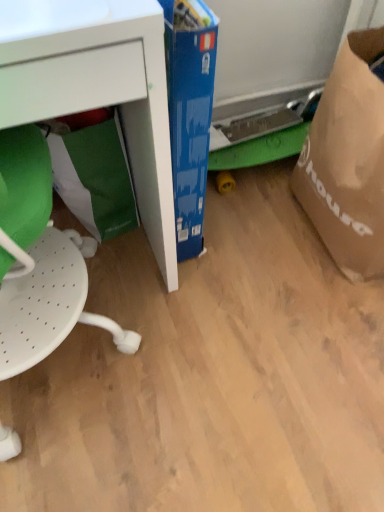
What do you see at coordinates (348, 159) in the screenshot? I see `brown paper grocery bag at right, which is the 2th grocery bag in left-to-right order` at bounding box center [348, 159].

Identify the location of white matte desk at lower left. The image size is (384, 512). (97, 88).

Identify the location of blue cardboard box at center. The height and width of the screenshot is (512, 384). (190, 113).

Measure the distance between point [27,174] and camera.

Point [27,174] is 28.23 inches away from camera.

You are a GUI agent. You are given a task and a screenshot of the screen. Output one action in this format:
    pyautogui.click(x=<x>, y=<y>)
    Task: Click on the brown paper grocery bag at right, which is counted as the first grocery bag, starting from the right
    This screenshot has width=384, height=512.
    Given the screenshot: What is the action you would take?
    pyautogui.click(x=348, y=159)

Between white perforated swivel chair at left and blue cardboard box at center, which one is positioned in front?

Positioned in front is white perforated swivel chair at left.

Can you confirm if white perforated swivel chair at left is shorter than blue cardboard box at center?

In fact, white perforated swivel chair at left may be taller than blue cardboard box at center.

From a real-world perspective, does white perforated swivel chair at left sit lower than blue cardboard box at center?

No, from a real-world perspective, white perforated swivel chair at left is not beneath blue cardboard box at center.

Which is behind, point (24, 360) or point (352, 68)?

The point (352, 68) is farther from the camera.

Can you confirm if white perforated swivel chair at left is positioned to the right of brown paper grocery bag at right, which is the 2th grocery bag in left-to-right order?

No, white perforated swivel chair at left is not to the right of brown paper grocery bag at right, which is the 2th grocery bag in left-to-right order.

Is white perforated swivel chair at left taller than brown paper grocery bag at right, which is the 2th grocery bag in left-to-right order?

Indeed, white perforated swivel chair at left has a greater height compared to brown paper grocery bag at right, which is the 2th grocery bag in left-to-right order.

Is green paper bag at lower left, the second grocery bag from the right, aimed at white matte desk at lower left?

Yes, green paper bag at lower left, the second grocery bag from the right, is aimed at white matte desk at lower left.

Who is taller, green paper bag at lower left, the second grocery bag from the right, or white matte desk at lower left?

white matte desk at lower left is taller.

The image size is (384, 512). Find the location of `grocery bag below the white matte desk at lower left (from the image's perspective)`. grocery bag below the white matte desk at lower left (from the image's perspective) is located at coordinates (93, 175).

Which of these two, green paper bag at lower left, which ranks as the 1th grocery bag in left-to-right order, or white matte desk at lower left, is bigger?

white matte desk at lower left.

Is blue cardboard box at center taller than white perforated swivel chair at left?

No, blue cardboard box at center is not taller than white perforated swivel chair at left.

Which is more to the left, blue cardboard box at center or white perforated swivel chair at left?

From the viewer's perspective, white perforated swivel chair at left appears more on the left side.

Considering the sizes of objects blue cardboard box at center and white perforated swivel chair at left in the image provided, who is thinner, blue cardboard box at center or white perforated swivel chair at left?

blue cardboard box at center.

Is point (179, 237) closer to viewer compared to point (119, 345)?

No, it is behind (119, 345).

Is brown paper grocery bag at right, which is counted as the first grocery bag, starting from the right, taller or shorter than green paper bag at lower left, the second grocery bag from the right?

Clearly, brown paper grocery bag at right, which is counted as the first grocery bag, starting from the right, is taller compared to green paper bag at lower left, the second grocery bag from the right.

Is point (377, 226) closer or farther from the camera than point (104, 193)?

Clearly, point (377, 226) is closer to the camera than point (104, 193).

Are brown paper grocery bag at right, which is the 2th grocery bag in left-to-right order, and green paper bag at lower left, which ranks as the 1th grocery bag in left-to-right order, making contact?

No, brown paper grocery bag at right, which is the 2th grocery bag in left-to-right order, is not next to green paper bag at lower left, which ranks as the 1th grocery bag in left-to-right order.

In terms of width, does brown paper grocery bag at right, which is counted as the first grocery bag, starting from the right, look wider or thinner when compared to green paper bag at lower left, the second grocery bag from the right?

In the image, brown paper grocery bag at right, which is counted as the first grocery bag, starting from the right, appears to be wider than green paper bag at lower left, the second grocery bag from the right.

Where is `desk lying on the left of blue cardboard box at center`? This screenshot has height=512, width=384. desk lying on the left of blue cardboard box at center is located at coordinates (97, 88).

Is blue cardboard box at center at the right side of white matte desk at lower left?

Yes, blue cardboard box at center is to the right of white matte desk at lower left.

Does point (166, 2) lie in front of point (141, 39)?

That is False.

From the picture: Is blue cardboard box at center located outside white matte desk at lower left?

Yes, blue cardboard box at center is not within white matte desk at lower left.

Is point (330, 207) positioned behind point (82, 84)?

Yes, point (330, 207) is behind point (82, 84).

From the image's perspective, which one is positioned lower, brown paper grocery bag at right, which is counted as the first grocery bag, starting from the right, or white matte desk at lower left?

From the image's view, white matte desk at lower left is below.

How different are the orientations of brown paper grocery bag at right, which is the 2th grocery bag in left-to-right order, and white matte desk at lower left in degrees?

The facing directions of brown paper grocery bag at right, which is the 2th grocery bag in left-to-right order, and white matte desk at lower left are 91.6 degrees apart.

From the white matte desk at lower left, count 2nd grocery bag to the right and point to it. Please provide its 2D coordinates.

[(348, 159)]

At what (x,y) coordinates should I click in order to perform the action: click on swivel chair in front of the blue cardboard box at center. Please return your answer as a coordinate pair (x, y). Looking at the image, I should click on (39, 261).

Where is `swivel chair lying on the left of brown paper grocery bag at right, which is the 2th grocery bag in left-to-right order`? This screenshot has height=512, width=384. swivel chair lying on the left of brown paper grocery bag at right, which is the 2th grocery bag in left-to-right order is located at coordinates (39, 261).

In the scene shown: Which object lies nearer to the anchor point blue cardboard box at center, white matte desk at lower left or brown paper grocery bag at right, which is counted as the first grocery bag, starting from the right?

white matte desk at lower left lies closer to blue cardboard box at center than the other object.

Estimate the real-world distances between objects in this image. Which object is closer to brown paper grocery bag at right, which is counted as the first grocery bag, starting from the right, white matte desk at lower left or blue cardboard box at center?

Among the two, blue cardboard box at center is located nearer to brown paper grocery bag at right, which is counted as the first grocery bag, starting from the right.

In the scene shown: Based on their spatial positions, is white perforated swivel chair at left or white matte desk at lower left closer to green paper bag at lower left, which ranks as the 1th grocery bag in left-to-right order?

Among the two, white perforated swivel chair at left is located nearer to green paper bag at lower left, which ranks as the 1th grocery bag in left-to-right order.

Looking at the image, which one is located closer to green paper bag at lower left, which ranks as the 1th grocery bag in left-to-right order, white matte desk at lower left or brown paper grocery bag at right, which is the 2th grocery bag in left-to-right order?

white matte desk at lower left lies closer to green paper bag at lower left, which ranks as the 1th grocery bag in left-to-right order, than the other object.

Based on the photo, looking at the image, which one is located closer to white matte desk at lower left, white perforated swivel chair at left or blue cardboard box at center?

blue cardboard box at center.

Looking at this image, estimate the real-world distances between objects in this image. Which object is closer to green paper bag at lower left, the second grocery bag from the right, brown paper grocery bag at right, which is the 2th grocery bag in left-to-right order, or blue cardboard box at center?

Based on the image, blue cardboard box at center appears to be nearer to green paper bag at lower left, the second grocery bag from the right.

Considering their positions, is brown paper grocery bag at right, which is the 2th grocery bag in left-to-right order, positioned closer to white matte desk at lower left than blue cardboard box at center?

blue cardboard box at center is positioned closer to the anchor white matte desk at lower left.

Estimate the real-world distances between objects in this image. Which object is closer to green paper bag at lower left, the second grocery bag from the right, white perforated swivel chair at left or brown paper grocery bag at right, which is the 2th grocery bag in left-to-right order?

white perforated swivel chair at left is positioned closer to the anchor green paper bag at lower left, the second grocery bag from the right.

The width and height of the screenshot is (384, 512). What are the coordinates of `grocery bag located between white matte desk at lower left and brown paper grocery bag at right, which is the 2th grocery bag in left-to-right order, in the left-right direction` in the screenshot? It's located at (93, 175).

Identify the location of cardboard box positioned between white matte desk at lower left and green paper bag at lower left, which ranks as the 1th grocery bag in left-to-right order, from near to far. Image resolution: width=384 pixels, height=512 pixels. [x=190, y=113].

The width and height of the screenshot is (384, 512). What are the coordinates of `desk between white perforated swivel chair at left and green paper bag at lower left, the second grocery bag from the right, in the front-back direction` in the screenshot? It's located at (97, 88).

The image size is (384, 512). Find the location of `cardboard box between white matte desk at lower left and brown paper grocery bag at right, which is the 2th grocery bag in left-to-right order`. cardboard box between white matte desk at lower left and brown paper grocery bag at right, which is the 2th grocery bag in left-to-right order is located at coordinates (190, 113).